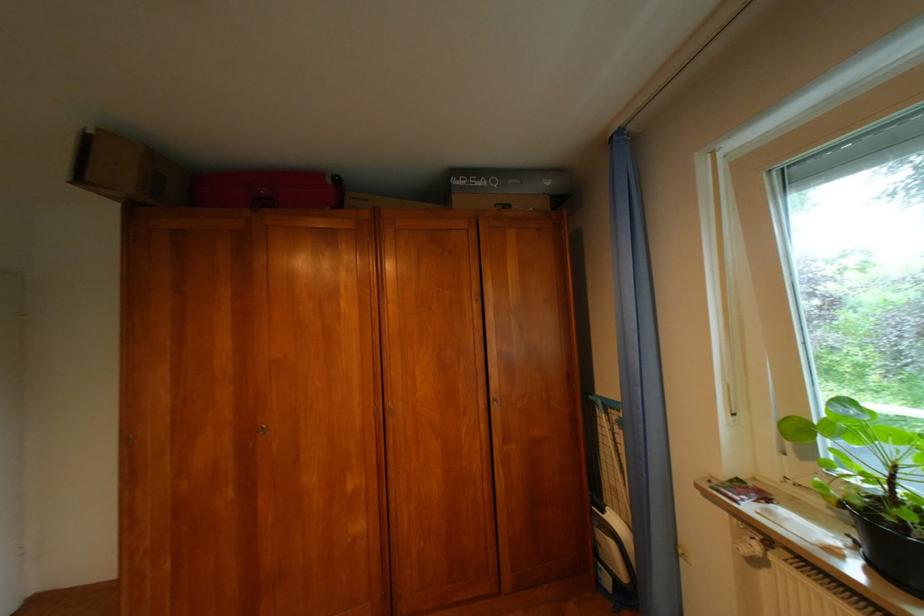
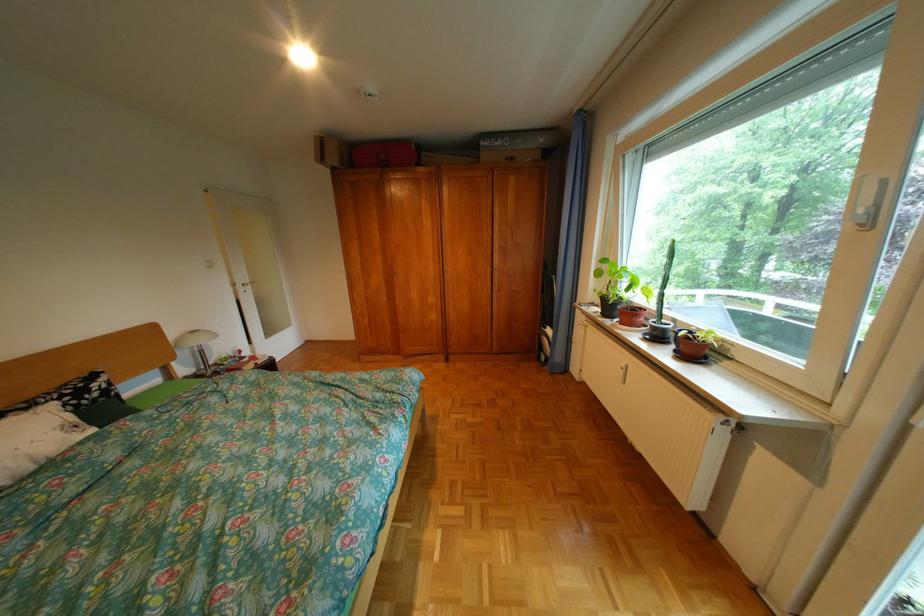
Question: In a continuous first-person perspective shot, in which direction is the camera moving?

Choices:
 (A) Left
 (B) Right
 (C) Forward
 (D) Backward

Answer: (D)